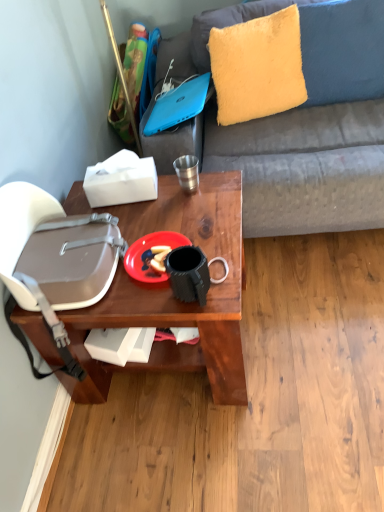
Question: Is blue matte laptop at upper center wider or thinner than fuzzy yellow pillow at upper right?

Choices:
 (A) thin
 (B) wide

Answer: (B)

Question: Is point (153, 106) closer or farther from the camera than point (296, 91)?

Choices:
 (A) closer
 (B) farther

Answer: (A)

Question: Estimate the real-world distances between objects in this image. Which object is closer to the wooden table at center?

Choices:
 (A) matte gray handbag at left
 (B) blue matte laptop at upper center
 (C) metallic silver cup at center
 (D) plastic matte plate at center
 (E) fuzzy yellow pillow at upper right

Answer: (A)

Question: Which object is the closest to the blue matte laptop at upper center?

Choices:
 (A) matte gray handbag at left
 (B) plastic matte plate at center
 (C) metallic silver cup at center
 (D) wooden table at center
 (E) fuzzy yellow pillow at upper right

Answer: (E)